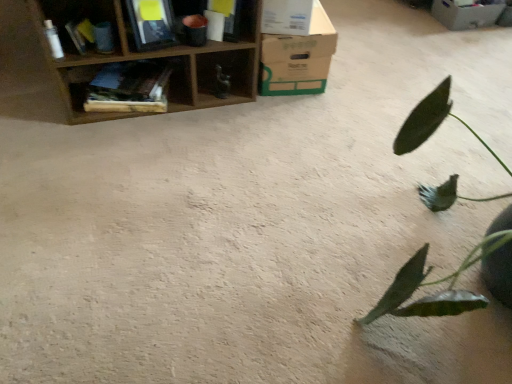
Question: From the image's perspective, is brown cardboard box at upper center, which is the 2th cardboard box from back to front, located above or below wooden bookshelf at upper left, which is the second shelf in left-to-right order?

Choices:
 (A) below
 (B) above

Answer: (B)

Question: Looking at the image, does brown cardboard box at upper center, the 1th cardboard box ordered from the bottom, seem bigger or smaller compared to wooden bookshelf at upper left, which is the second shelf in left-to-right order?

Choices:
 (A) big
 (B) small

Answer: (A)

Question: Estimate the real-world distances between objects in this image. Which object is farther from the wooden shelf at upper left, placed as the first shelf when sorted from right to left?

Choices:
 (A) wooden bookshelf at upper left, the second shelf when ordered from right to left
 (B) cardboard box at upper right, positioned as the first cardboard box in right-to-left order
 (C) green matte leafy plant at right
 (D) wooden bookshelf at upper left, the 3th shelf when ordered from right to left
 (E) brown cardboard box at upper center, positioned as the second cardboard box in right-to-left order

Answer: (B)

Question: Estimate the real-world distances between objects in this image. Which object is closer to the cardboard box at upper right, arranged as the 1th cardboard box when viewed from the back?

Choices:
 (A) brown cardboard box at upper center, which appears as the first cardboard box when viewed from the front
 (B) wooden bookshelf at upper left, the 3th shelf when ordered from right to left
 (C) wooden bookshelf at upper left, the second shelf when ordered from right to left
 (D) wooden shelf at upper left, placed as the first shelf when sorted from right to left
 (E) green matte leafy plant at right

Answer: (A)